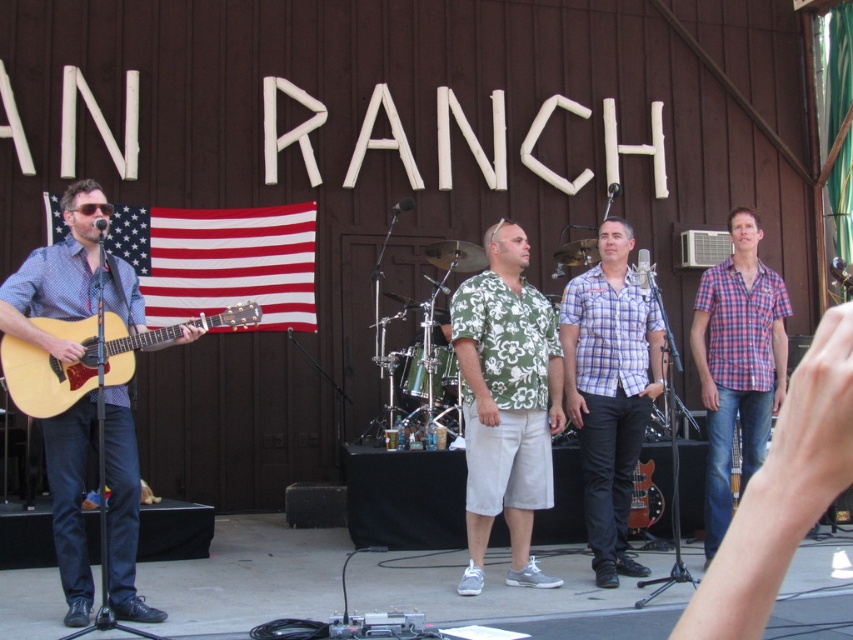
You are a stagehand needing to place a 1.5 meter long banner between the green floral shirt at center and the plaid shirt at right. Can the banner fit without overlapping either performer?

The distance between the green floral shirt at center and the plaid shirt at right is 1.24 meters. Since the banner is 1.5 meters long, it cannot fit between them without overlapping either performer.

You are a photographer standing at the front of the stage. You want to take a photo that includes both the point at position (511, 508) and the point at position (778, 304). Which point should you focus on first to ensure both are in focus?

You should focus on point (511, 508) first because it is closer to the camera than point (778, 304), ensuring both will be in focus when using a shallow depth of field.